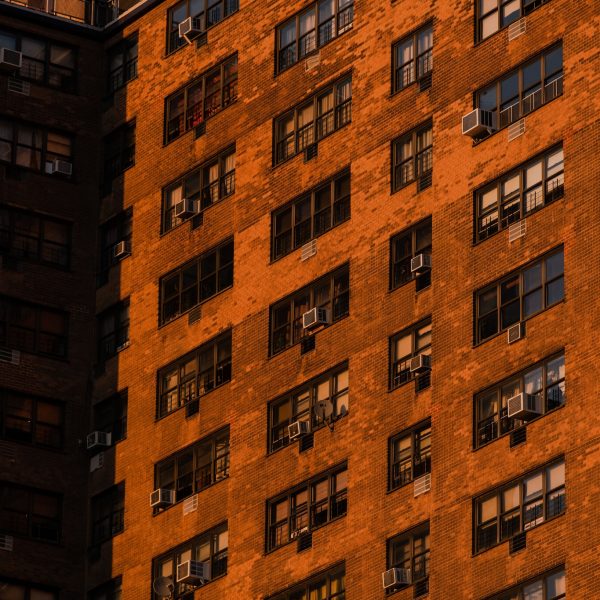
Identify the location of vent. The image size is (600, 600). (516, 333).